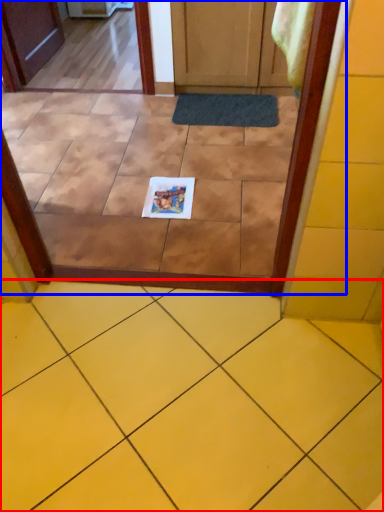
Question: Among these objects, which one is nearest to the camera, ceramic tile (highlighted by a red box) or glass door (highlighted by a blue box)?

Choices:
 (A) ceramic tile
 (B) glass door

Answer: (A)